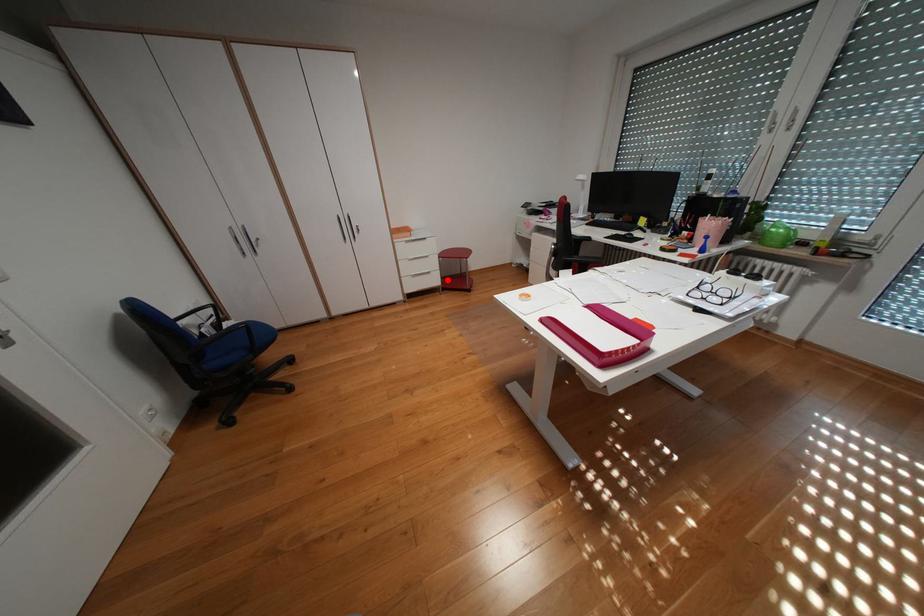
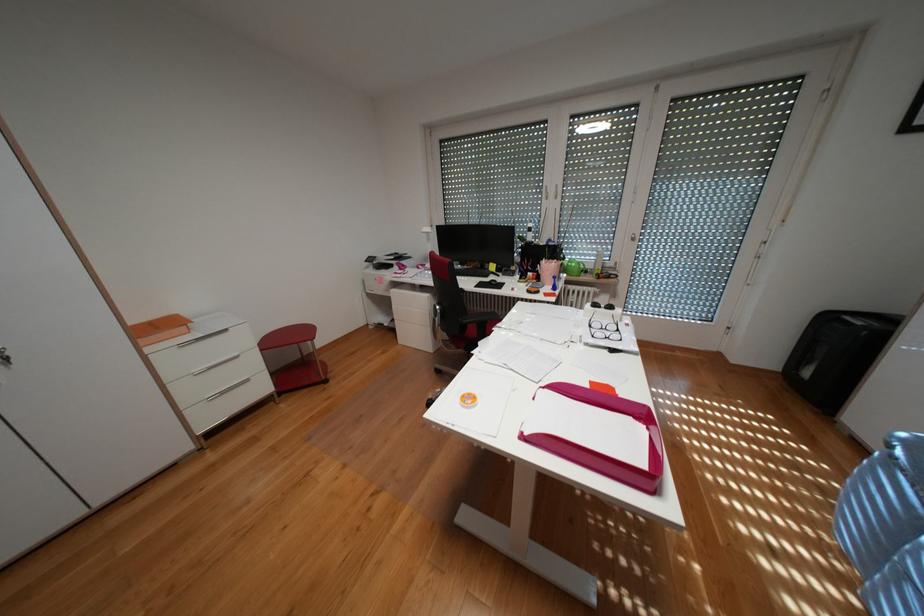
Where in the second image is the point corresponding to the highlighted location from the first image?

(274, 387)